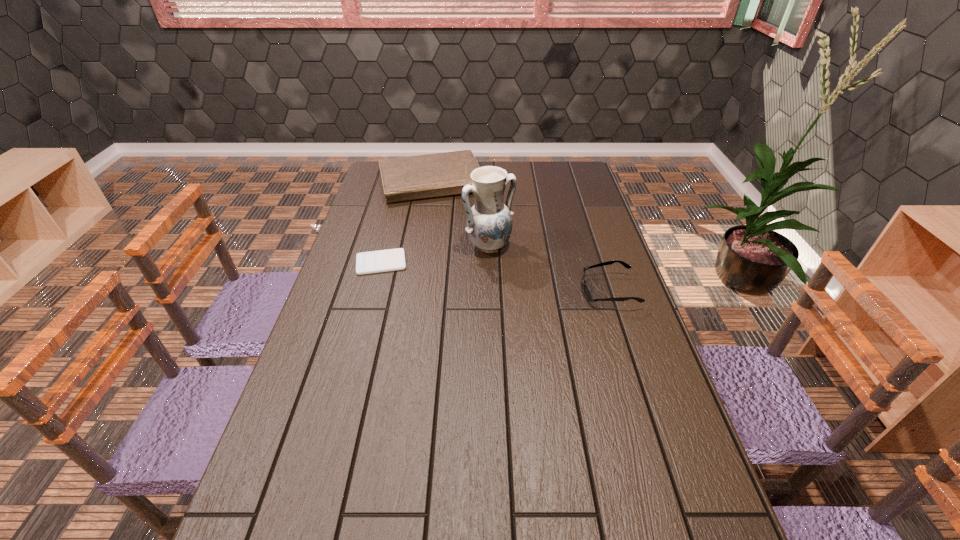
The width and height of the screenshot is (960, 540). Find the location of `calculator`. calculator is located at coordinates (379, 261).

I want to click on the rightmost object, so click(587, 292).

Locate an element on the screen. This screenshot has height=540, width=960. the second shortest object is located at coordinates (587, 292).

Locate an element on the screen. The image size is (960, 540). paperback book is located at coordinates (441, 174).

Find the location of `the second tallest object`. the second tallest object is located at coordinates coord(441,174).

At what (x,y) coordinates should I click in order to perform the action: click on the tallest object. Please return your answer as a coordinate pair (x, y). The image size is (960, 540). Looking at the image, I should click on (489, 222).

Locate an element on the screen. The height and width of the screenshot is (540, 960). free space located 0.280m on the front of the calculator is located at coordinates (359, 343).

Where is `vacant space located 0.110m on the lenses of the sunglasses`? This screenshot has height=540, width=960. vacant space located 0.110m on the lenses of the sunglasses is located at coordinates (544, 291).

This screenshot has height=540, width=960. Find the location of `free point located on the lenses of the sunglasses`. free point located on the lenses of the sunglasses is located at coordinates (498, 291).

At what (x,y) coordinates should I click in order to perform the action: click on vacant area situated 0.300m on the lenses of the sunglasses. Please return your answer as a coordinate pair (x, y). Looking at the image, I should click on (482, 291).